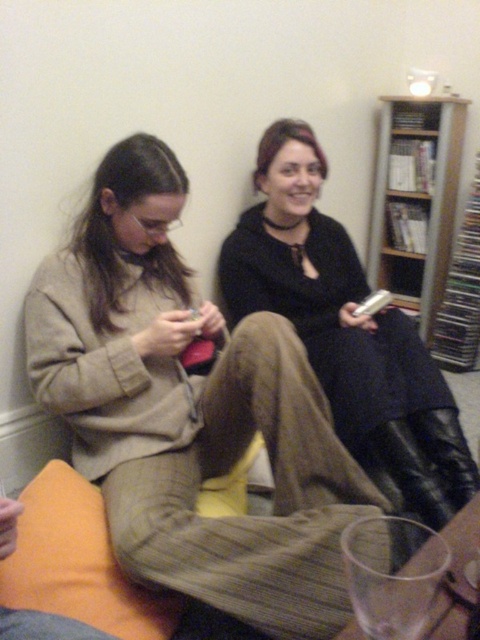
You are standing in the living room and want to reach the point marked as point (223, 541). If you take a step forward of 2 feet, will you be closer to or farther from the point?

The point (223, 541) is 3.99 feet from the viewer. If you take a step forward of 2 feet, you will be 1.99 feet away from the point, so you will be closer to the point.

You are a delivery person who needs to place a small package on the wooden bookshelf at upper right. However, there is a beige woolen sweater at center in the way. Can you place the package directly on the shelf without moving the sweater?

The beige woolen sweater at center is located below the wooden bookshelf at upper right, so it is not blocking the shelf. You can place the package directly on the wooden bookshelf at upper right without moving the sweater.

You are a delivery robot that needs to place a package between the black leather boots at center and the orange fabric pillow at lower left. The package requires a space of 30 inches. Can you fit it there?

The black leather boots at center is 32.21 inches away from orange fabric pillow at lower left. Since the distance is greater than 30 inches, the package can fit between them.